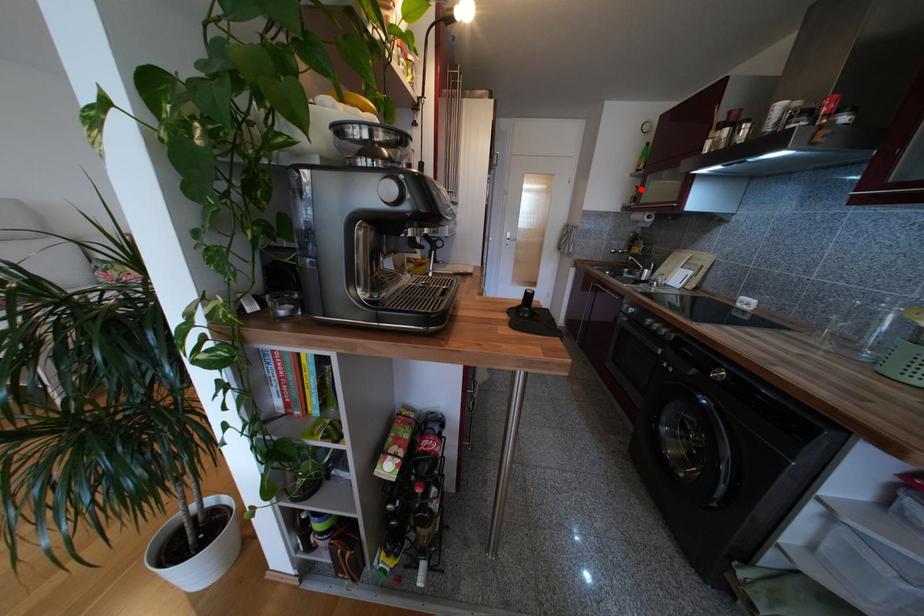
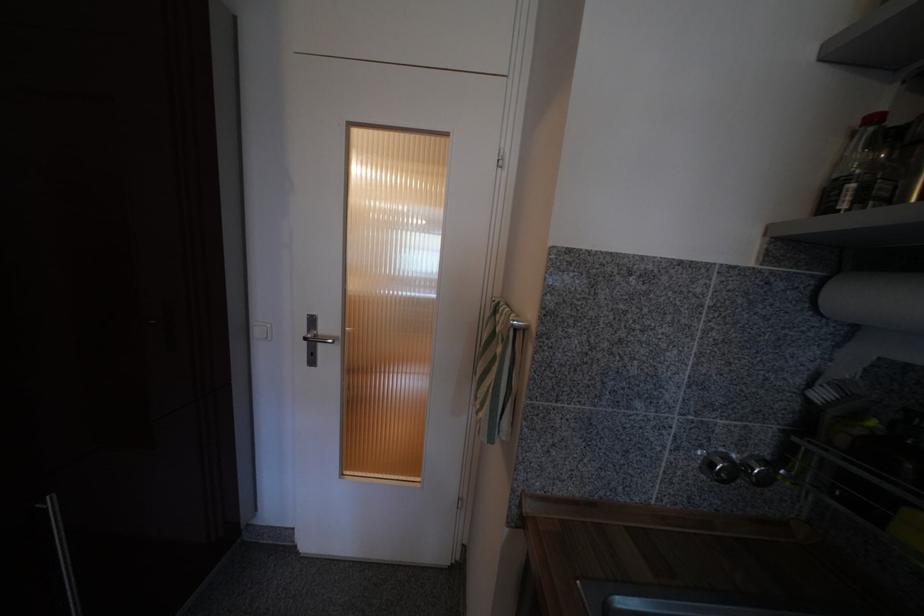
Locate, in the second image, the point that corresponds to the highlighted location in the first image.

(879, 121)